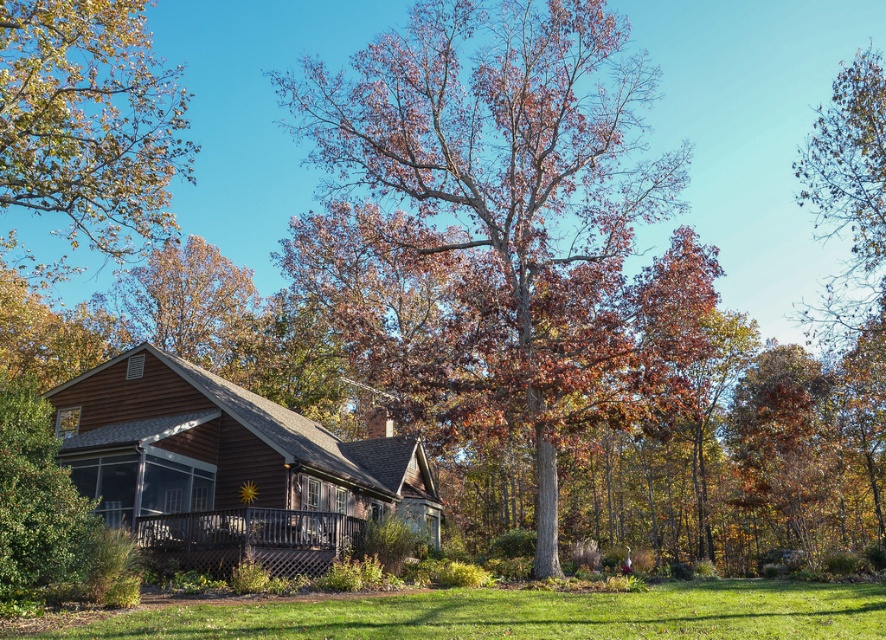
You are standing at the point with coordinates point (107, 208) and want to walk towards the house. Is the point (526, 160) in your path?

Yes, the point (526, 160) is in front of point (107, 208), so it is in your path towards the house.